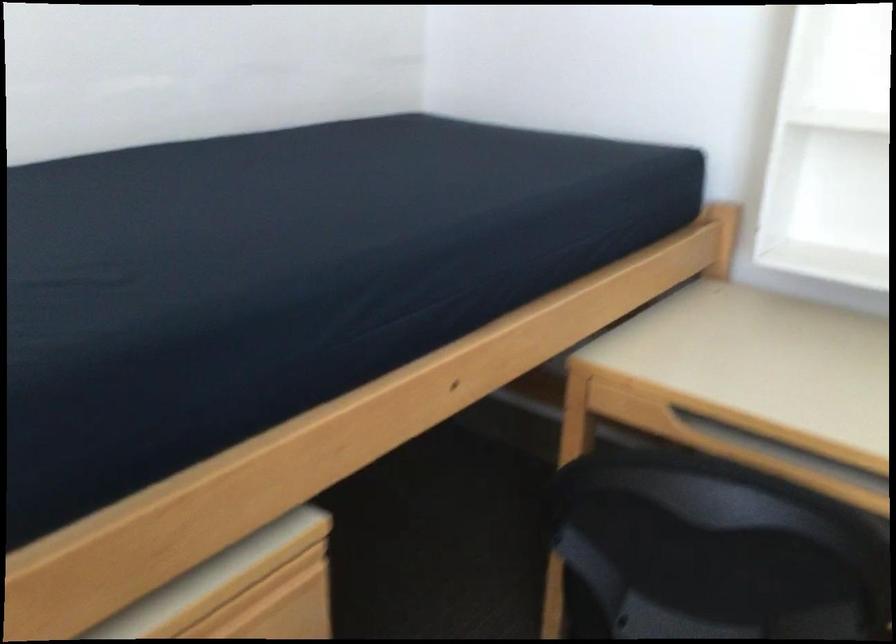
The image size is (896, 644). Describe the element at coordinates (790, 473) in the screenshot. I see `the desk drawer handle` at that location.